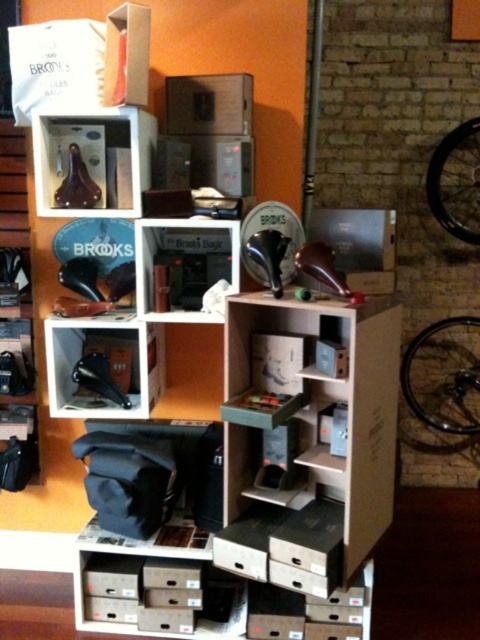
Question: Does matte black saddle at lower left come in front of matte black brooks saddle at center?

Choices:
 (A) yes
 (B) no

Answer: (B)

Question: Is silver metallic bicycle wheel at right above matte black brooks saddle at center?

Choices:
 (A) yes
 (B) no

Answer: (A)

Question: Which point appears farthest from the camera in this image?

Choices:
 (A) (158, 227)
 (B) (98, 134)
 (C) (455, 380)
 (D) (190, 81)

Answer: (C)

Question: Which point is farther to the camera?

Choices:
 (A) wooden at center
 (B) silver metallic bicycle wheel at right
 (C) matte black saddle at lower left
 (D) matte cardboard box at upper center

Answer: (B)

Question: Is matte brown saddle at upper left positioned at the back of matte black brooks saddle at center?

Choices:
 (A) no
 (B) yes

Answer: (A)

Question: Estimate the real-world distances between objects in this image. Which object is farther from the matte black saddle at lower left?

Choices:
 (A) silver metallic bicycle wheel at right
 (B) wooden at center
 (C) matte cardboard box at upper center

Answer: (A)